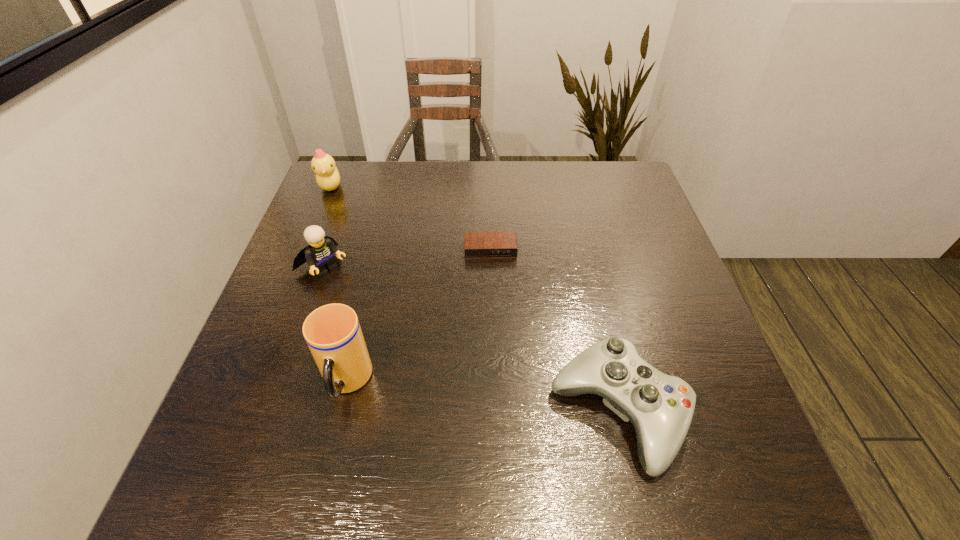
Identify the location of free space located 0.300m on the front-facing side of the farthest object. (381, 254).

The image size is (960, 540). I want to click on vacant space located 0.100m on the front-facing side of the farthest object, so click(x=348, y=214).

This screenshot has height=540, width=960. I want to click on free spot located 0.070m on the front-facing side of the Lego, so click(355, 294).

Identify the location of vacant space located 0.150m on the front-facing side of the Lego. (376, 313).

This screenshot has width=960, height=540. Identify the location of vacant space located 0.050m on the front-facing side of the Lego. (349, 290).

The image size is (960, 540). Find the location of `vacant space located 0.390m on the front face of the shortest object`. vacant space located 0.390m on the front face of the shortest object is located at coordinates (500, 402).

Where is `vacant space located on the front face of the shortest object`? This screenshot has height=540, width=960. vacant space located on the front face of the shortest object is located at coordinates (497, 361).

Where is `blank area located 0.390m on the front face of the shortest object`? The width and height of the screenshot is (960, 540). blank area located 0.390m on the front face of the shortest object is located at coordinates (500, 402).

Image resolution: width=960 pixels, height=540 pixels. What are the coordinates of `object positioned at the far edge` in the screenshot? It's located at (327, 175).

Find the location of a particular element. cup that is at the near edge is located at coordinates (332, 332).